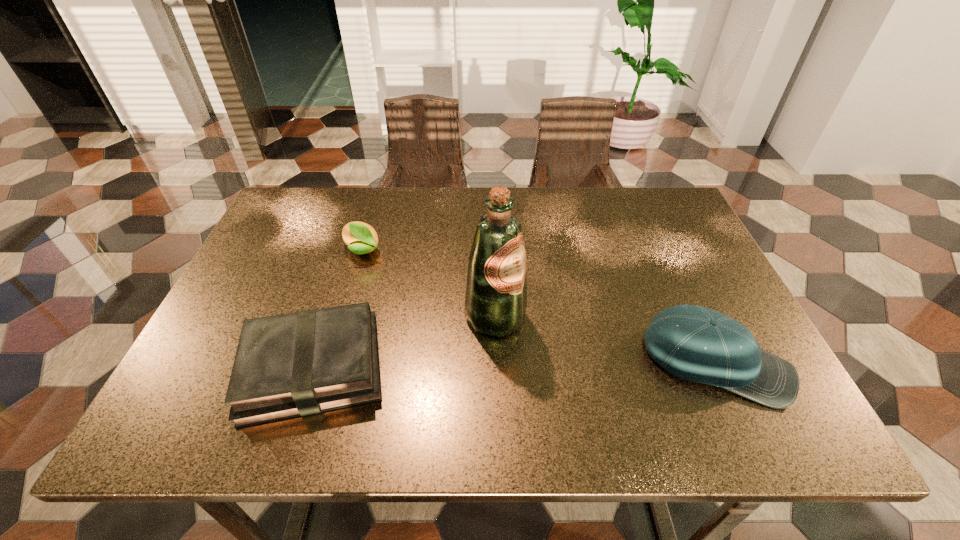
This screenshot has height=540, width=960. I want to click on vacant region located 0.100m with leaves positioned above the farthest object, so click(x=402, y=276).

At what (x,y) coordinates should I click in order to perform the action: click on vacant space situated with leaves positioned above the farthest object. Please return your answer as a coordinate pair (x, y). The width and height of the screenshot is (960, 540). Looking at the image, I should click on (408, 280).

You are a GUI agent. You are given a task and a screenshot of the screen. Output one action in this format:
    pyautogui.click(x=<x>, y=<y>)
    Task: Click on the vacant area situated on the front-facing side of the olive oil
    
    Given the screenshot: What is the action you would take?
    pyautogui.click(x=570, y=362)

You are a GUI agent. You are given a task and a screenshot of the screen. Output one action in this format:
    pyautogui.click(x=<x>, y=<y>)
    Task: Click on the vacant area situated on the front-facing side of the olive oil
    
    Given the screenshot: What is the action you would take?
    pyautogui.click(x=622, y=394)

At what (x,y) coordinates should I click in order to perform the action: click on vacant space situated 0.170m on the front-facing side of the olive oil. Please return your answer as a coordinate pair (x, y). Image resolution: width=960 pixels, height=540 pixels. Looking at the image, I should click on [x=587, y=373].

Find the location of a particular element. Image resolution: width=960 pixels, height=540 pixels. book at the near edge is located at coordinates (297, 364).

Where is `baseball cap that is at the near edge`? This screenshot has width=960, height=540. baseball cap that is at the near edge is located at coordinates (695, 343).

Where is `object that is at the left edge`? This screenshot has height=540, width=960. object that is at the left edge is located at coordinates (297, 364).

You are a GUI agent. You are given a task and a screenshot of the screen. Output one action in this format:
    pyautogui.click(x=<x>, y=<y>)
    Task: Click on the object present at the right edge
    The width and height of the screenshot is (960, 540).
    Given the screenshot: What is the action you would take?
    pyautogui.click(x=695, y=343)

Where is `object that is at the near left corner`? The width and height of the screenshot is (960, 540). object that is at the near left corner is located at coordinates (297, 364).